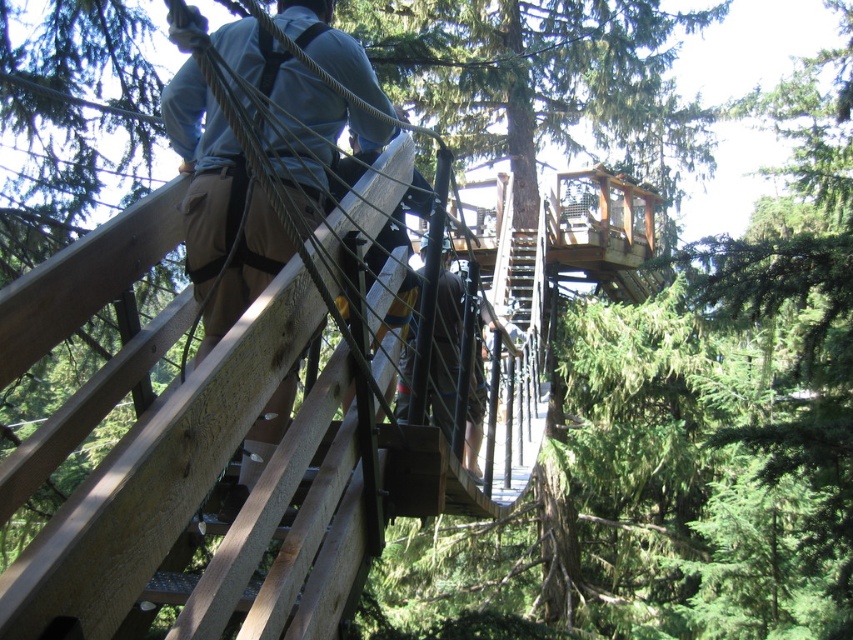
Question: Does brown leather pants at upper left have a greater width compared to brown leather pants at center?

Choices:
 (A) yes
 (B) no

Answer: (A)

Question: Does brown leather pants at upper left appear under brown leather pants at center?

Choices:
 (A) no
 (B) yes

Answer: (A)

Question: Can you confirm if brown leather pants at upper left is smaller than brown leather pants at center?

Choices:
 (A) yes
 (B) no

Answer: (A)